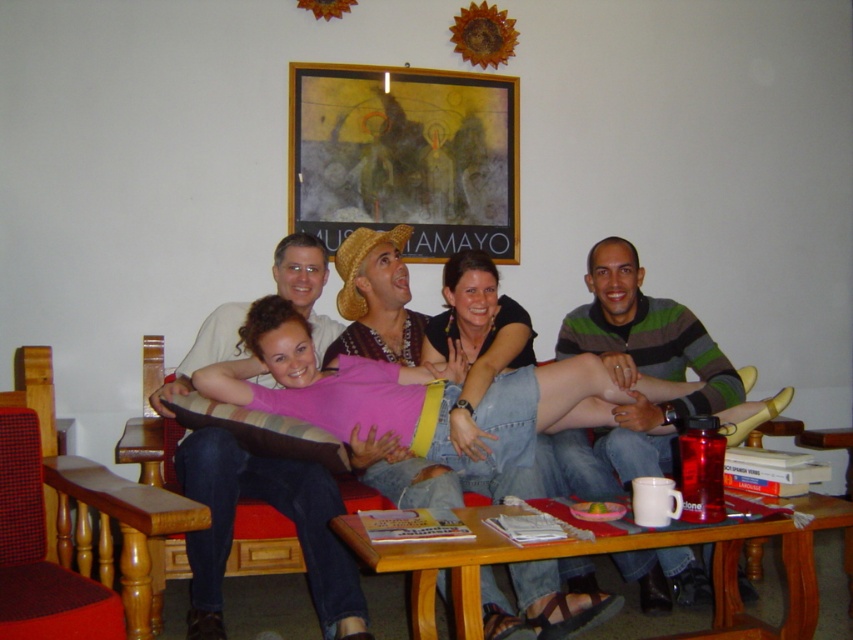
You are planning to host a small gathering and need to seat 4 people comfortably. You have access to the wooden table at lower center and the wooden bench at lower left. Which object can accommodate more guests based on their sizes?

The wooden table at lower center has a larger size compared to the wooden bench at lower left, so it can accommodate more guests comfortably.